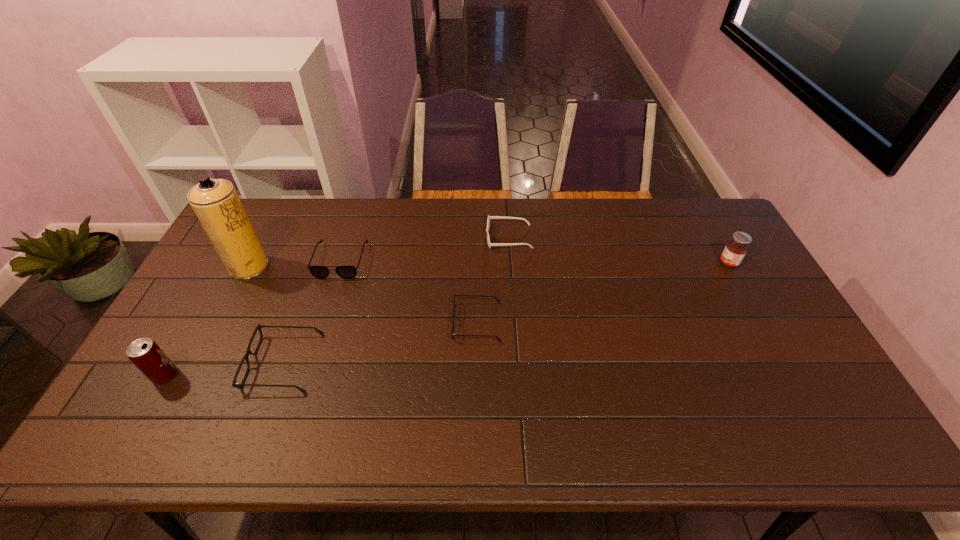
Where is `free space between the tallest object and the beer can`? Image resolution: width=960 pixels, height=540 pixels. free space between the tallest object and the beer can is located at coordinates (207, 321).

At what (x,y) coordinates should I click in order to perform the action: click on blank region between the rightmost object and the shortest spectacles. Please return your answer as a coordinate pair (x, y). Image resolution: width=960 pixels, height=540 pixels. Looking at the image, I should click on (603, 292).

Where is `empty location between the farthest spectacles and the tallest object`? empty location between the farthest spectacles and the tallest object is located at coordinates (295, 264).

I want to click on free space that is in between the shortest spectacles and the aerosol can, so click(x=363, y=294).

At what (x,y) coordinates should I click in order to perform the action: click on free space between the tallest object and the sunglasses. Please return your answer as a coordinate pair (x, y). This screenshot has height=540, width=960. Looking at the image, I should click on (379, 252).

Find the location of `empty space between the jam and the sunglasses`. empty space between the jam and the sunglasses is located at coordinates (618, 251).

This screenshot has height=540, width=960. Identify the location of unoccupied position between the sunglasses and the farthest spectacles. (424, 249).

Image resolution: width=960 pixels, height=540 pixels. I want to click on blank region between the sunglasses and the aerosol can, so click(x=379, y=252).

The width and height of the screenshot is (960, 540). I want to click on free area in between the sunglasses and the rightmost object, so click(618, 251).

Where is `blank region between the beer can and the aerosol can`? blank region between the beer can and the aerosol can is located at coordinates (207, 321).